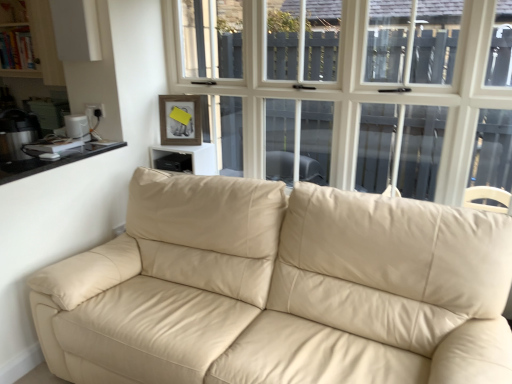
Question: Could white plastic toaster at left, the second appliance when ordered from left to right, be considered to be inside beige leather couch at center?

Choices:
 (A) yes
 (B) no

Answer: (B)

Question: Is beige leather couch at center at the right side of white plastic toaster at left, which is the 1th appliance in right-to-left order?

Choices:
 (A) yes
 (B) no

Answer: (A)

Question: Is beige leather couch at center closer to camera compared to white plastic toaster at left, which is the 1th appliance in right-to-left order?

Choices:
 (A) no
 (B) yes

Answer: (B)

Question: From a real-world perspective, is beige leather couch at center positioned under white plastic toaster at left, which is the 1th appliance in right-to-left order, based on gravity?

Choices:
 (A) no
 (B) yes

Answer: (B)

Question: Could you tell me if beige leather couch at center is turned towards white plastic toaster at left, the second appliance when ordered from left to right?

Choices:
 (A) no
 (B) yes

Answer: (A)

Question: From the image's perspective, would you say beige leather couch at center is shown under white plastic toaster at left, which is the 1th appliance in right-to-left order?

Choices:
 (A) no
 (B) yes

Answer: (B)

Question: Is black glass counter top at left positioned beyond the bounds of black plastic speaker at upper center?

Choices:
 (A) yes
 (B) no

Answer: (A)

Question: Does black glass counter top at left turn towards black plastic speaker at upper center?

Choices:
 (A) yes
 (B) no

Answer: (B)

Question: From the image's perspective, is black glass counter top at left located above black plastic speaker at upper center?

Choices:
 (A) no
 (B) yes

Answer: (A)

Question: Is black glass counter top at left beside black plastic speaker at upper center?

Choices:
 (A) no
 (B) yes

Answer: (A)

Question: From the image's perspective, is black glass counter top at left beneath black plastic speaker at upper center?

Choices:
 (A) no
 (B) yes

Answer: (B)

Question: Is black glass counter top at left positioned with its back to black plastic speaker at upper center?

Choices:
 (A) yes
 (B) no

Answer: (B)

Question: Is metallic silver kettle at left, the second appliance when ordered from right to left, to the left of black glass counter top at left from the viewer's perspective?

Choices:
 (A) no
 (B) yes

Answer: (B)